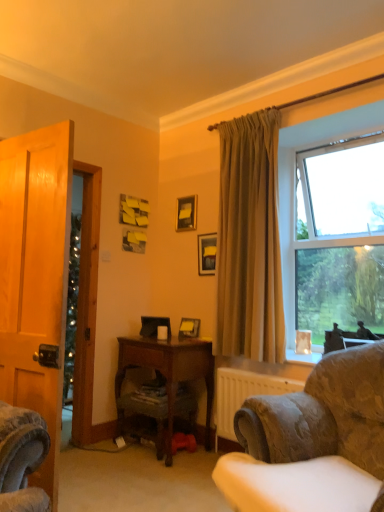
Locate an element on the screen. The height and width of the screenshot is (512, 384). vacant area that lies in front of wooden desk at center is located at coordinates (151, 476).